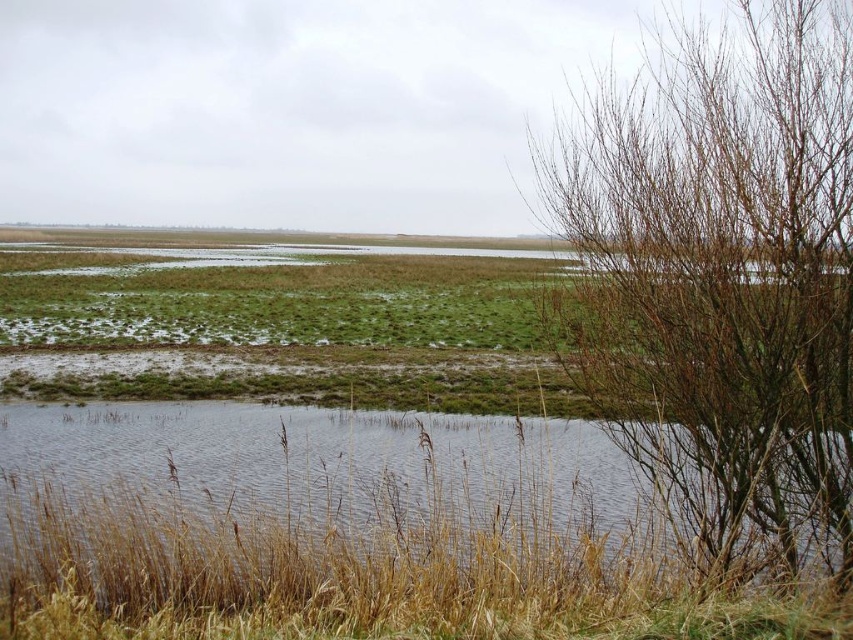
You are a wildlife photographer with a camera bag that requires 8 meters of space to set up your equipment. You are standing in the wetland scene and see the brown grass at lower left and the bare branches at right. Can you set up your equipment between them?

The distance between the brown grass at lower left and the bare branches at right is 9.29 meters, which is more than enough space for your camera bag setup requiring 8 meters.

You are a bird flying over the wetland and need to land. You see the brown grass at lower left and the bare branches at right. Which location would provide a stable landing spot based on their positions?

The brown grass at lower left is located below the bare branches at right. Since the grass is lower, it might offer a more stable landing due to being closer to the ground compared to the elevated branches.